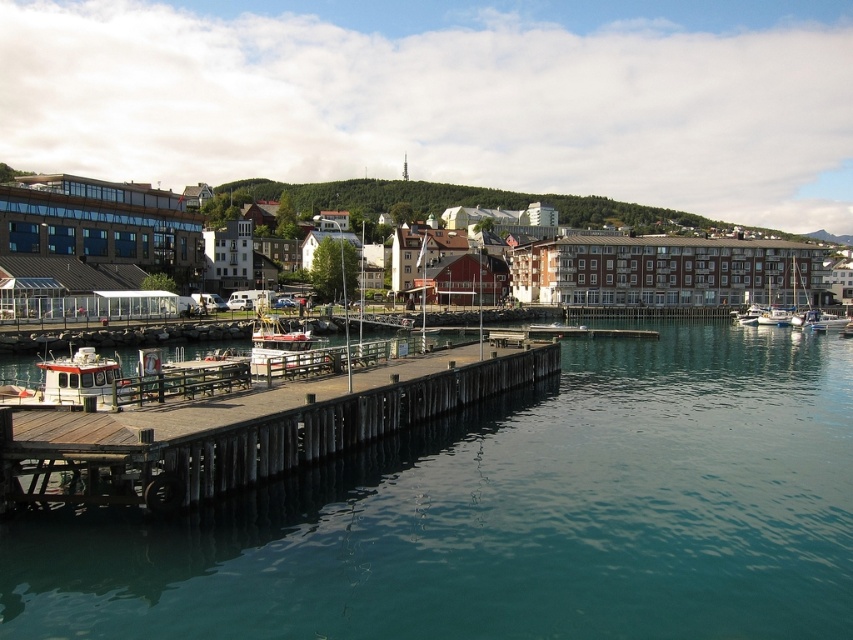
Question: Is white matte boat at lower left positioned before white plastic boat at lower right?

Choices:
 (A) no
 (B) yes

Answer: (B)

Question: Estimate the real-world distances between objects in this image. Which object is closer to the white wooden boat at center?

Choices:
 (A) wooden dock at center
 (B) clear blue water at center
 (C) white plastic boat at lower right
 (D) white matte boat at lower left

Answer: (A)

Question: Which point appears farthest from the camera in this image?

Choices:
 (A) (299, 348)
 (B) (36, 460)

Answer: (A)

Question: Does clear blue water at center appear on the right side of white matte boat at lower left?

Choices:
 (A) yes
 (B) no

Answer: (A)

Question: Is wooden dock at center wider than white matte boat at lower left?

Choices:
 (A) yes
 (B) no

Answer: (A)

Question: Among these objects, which one is farthest from the camera?

Choices:
 (A) clear blue water at center
 (B) white plastic boat at lower right
 (C) white matte boat at lower left
 (D) white wooden boat at center

Answer: (B)